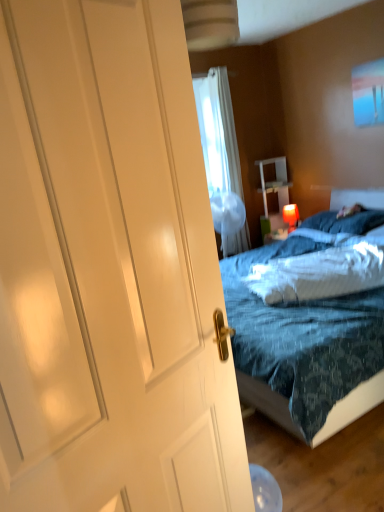
Question: Which direction should I rotate to look at blue soft pillow at center, which is the 2th pillow from front to back?

Choices:
 (A) right
 (B) left

Answer: (A)

Question: From a real-world perspective, does matte red lampshade at upper right sit lower than white glossy door at left?

Choices:
 (A) no
 (B) yes

Answer: (B)

Question: Can you confirm if matte red lampshade at upper right is thinner than white glossy door at left?

Choices:
 (A) no
 (B) yes

Answer: (A)

Question: From the image's perspective, is matte red lampshade at upper right under white glossy door at left?

Choices:
 (A) no
 (B) yes

Answer: (A)

Question: Is matte red lampshade at upper right next to white glossy door at left and touching it?

Choices:
 (A) yes
 (B) no

Answer: (B)

Question: Is there a large distance between matte red lampshade at upper right and white glossy door at left?

Choices:
 (A) yes
 (B) no

Answer: (A)

Question: Could you tell me if matte red lampshade at upper right is turned towards white glossy door at left?

Choices:
 (A) no
 (B) yes

Answer: (A)

Question: Considering the relative positions of white fluffy pillow at center, the second pillow in the top-to-bottom sequence, and white glossy nightstand at center in the image provided, is white fluffy pillow at center, the second pillow in the top-to-bottom sequence, behind white glossy nightstand at center?

Choices:
 (A) no
 (B) yes

Answer: (A)

Question: From the image's perspective, is white fluffy pillow at center, placed as the 1th pillow when sorted from bottom to top, above white glossy nightstand at center?

Choices:
 (A) yes
 (B) no

Answer: (B)

Question: Can you confirm if white fluffy pillow at center, placed as the 1th pillow when sorted from bottom to top, is shorter than white glossy nightstand at center?

Choices:
 (A) yes
 (B) no

Answer: (A)

Question: From a real-world perspective, is white fluffy pillow at center, arranged as the 2th pillow when viewed from the back, on top of white glossy nightstand at center?

Choices:
 (A) no
 (B) yes

Answer: (A)

Question: Does white fluffy pillow at center, the second pillow in the top-to-bottom sequence, have a greater height compared to white glossy nightstand at center?

Choices:
 (A) no
 (B) yes

Answer: (A)

Question: Is white fluffy pillow at center, which is the first pillow from front to back, positioned beyond the bounds of white glossy nightstand at center?

Choices:
 (A) no
 (B) yes

Answer: (B)

Question: From the image's perspective, is blue soft pillow at center, which is the first pillow in back-to-front order, beneath white fluffy pillow at center, placed as the 1th pillow when sorted from bottom to top?

Choices:
 (A) yes
 (B) no

Answer: (B)